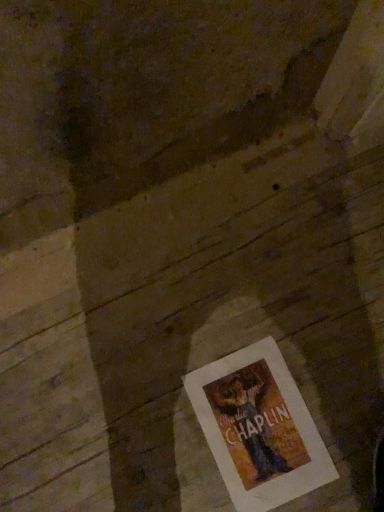
Identify the location of vacant area situated to the left side of matte paper poster at lower center. (147, 434).